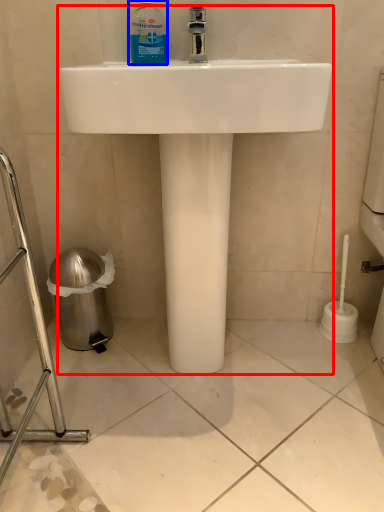
Question: Among these objects, which one is nearest to the camera, sink (highlighted by a red box) or cleaning product (highlighted by a blue box)?

Choices:
 (A) sink
 (B) cleaning product

Answer: (A)